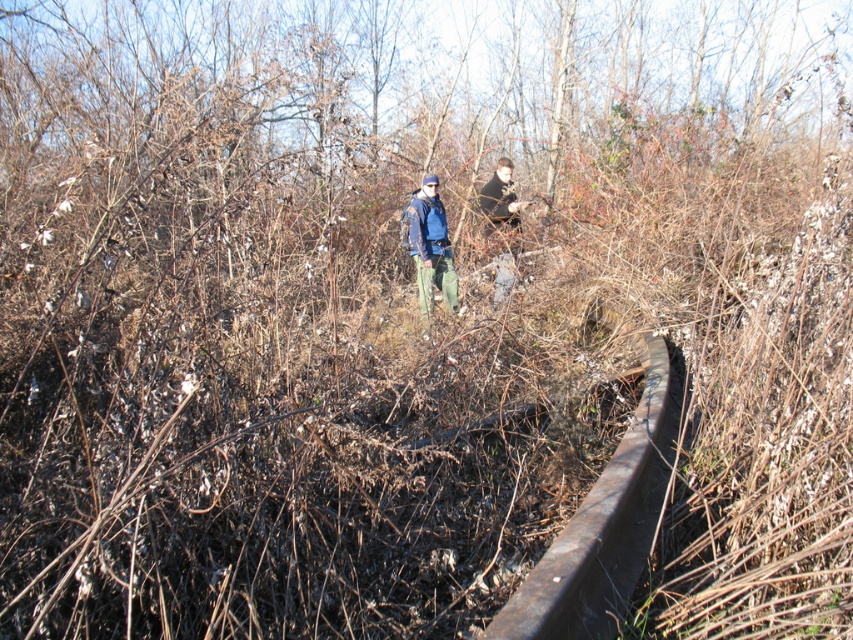
Question: Which point is closer to the camera?

Choices:
 (A) dark blue jacket at center
 (B) blue denim jacket at center

Answer: (B)

Question: Is rusty metal rail at center thinner than blue denim jacket at center?

Choices:
 (A) yes
 (B) no

Answer: (B)

Question: Among these objects, which one is nearest to the camera?

Choices:
 (A) dark blue jacket at center
 (B) blue denim jacket at center
 (C) rusty metal rail at center

Answer: (C)

Question: Does rusty metal rail at center appear under dark blue jacket at center?

Choices:
 (A) no
 (B) yes

Answer: (B)

Question: Which is farther from the rusty metal rail at center?

Choices:
 (A) dark blue jacket at center
 (B) blue denim jacket at center

Answer: (A)

Question: Is rusty metal rail at center thinner than dark blue jacket at center?

Choices:
 (A) yes
 (B) no

Answer: (B)